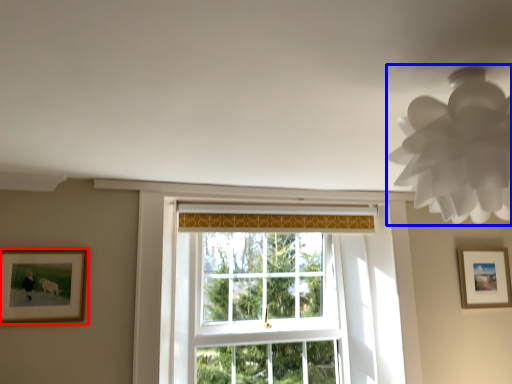
Question: Among these objects, which one is nearest to the camera, picture frame (highlighted by a red box) or lamp (highlighted by a blue box)?

Choices:
 (A) picture frame
 (B) lamp

Answer: (B)